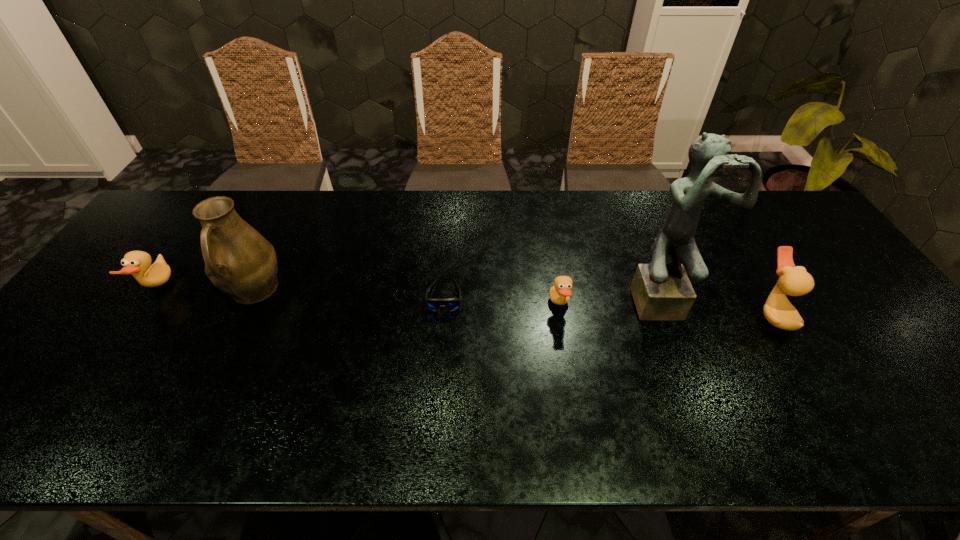
If the aim is uniform spacing by inserting an additional duck among them, please point to a vacant space for this new duck. Please provide its 2D coordinates. Your answer should be formatted as a tuple, i.e. [(x, y)], where the tuple contains the x and y coordinates of a point satisfying the conditions above.

[(354, 296)]